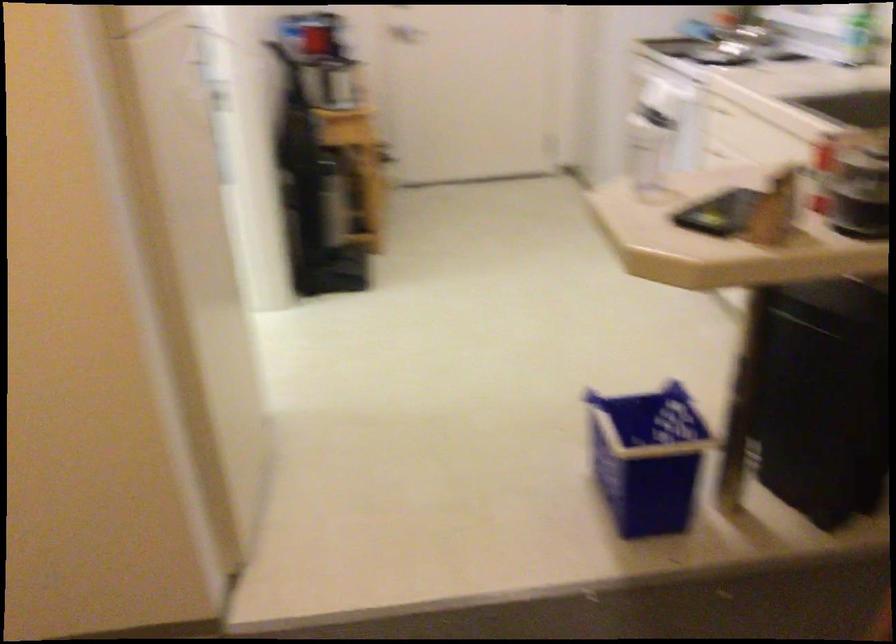
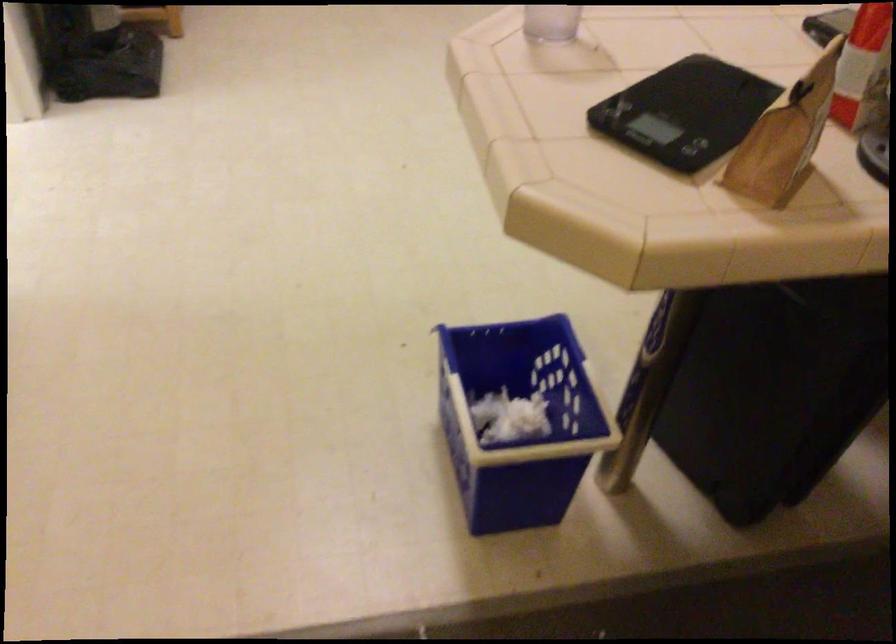
In the second image, find the point that corresponds to point (773, 205) in the first image.

(785, 137)